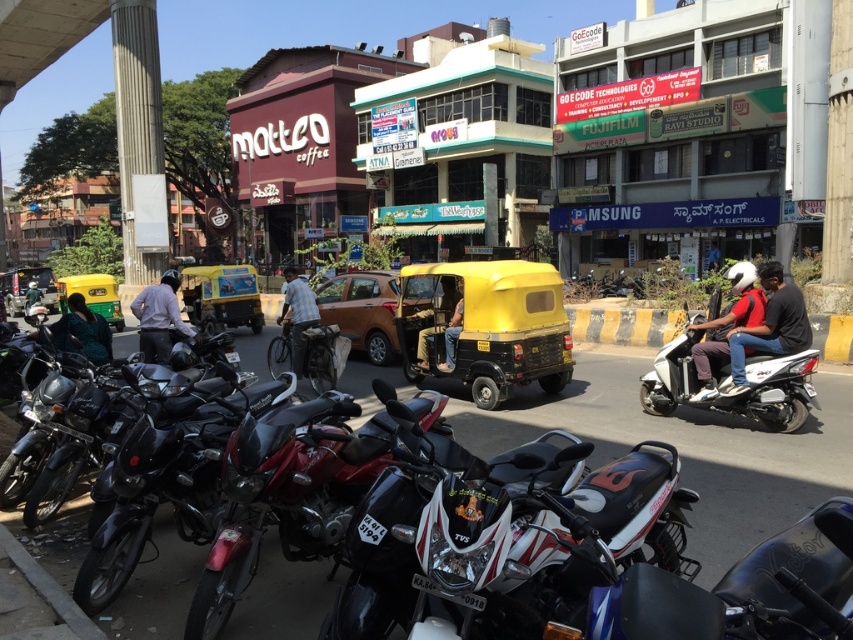
Question: Is yellow matte taxi at center thinner than dark green fabric jacket at left?

Choices:
 (A) no
 (B) yes

Answer: (A)

Question: Does yellow matte taxi at center have a greater width compared to light brown leather jacket at center?

Choices:
 (A) no
 (B) yes

Answer: (A)

Question: Which of the following is the farthest from the observer?

Choices:
 (A) white glossy scooter at center-right
 (B) dark green fabric jacket at left

Answer: (B)

Question: Is shiny black motorcycle at center below white glossy motorcycle at lower right?

Choices:
 (A) no
 (B) yes

Answer: (B)

Question: Which point is closer to the camera taking this photo?

Choices:
 (A) (306, 321)
 (B) (448, 300)
 (C) (341, 292)

Answer: (A)

Question: Which point is closer to the camera?

Choices:
 (A) (143, 348)
 (B) (316, 324)
 (C) (361, 305)

Answer: (A)